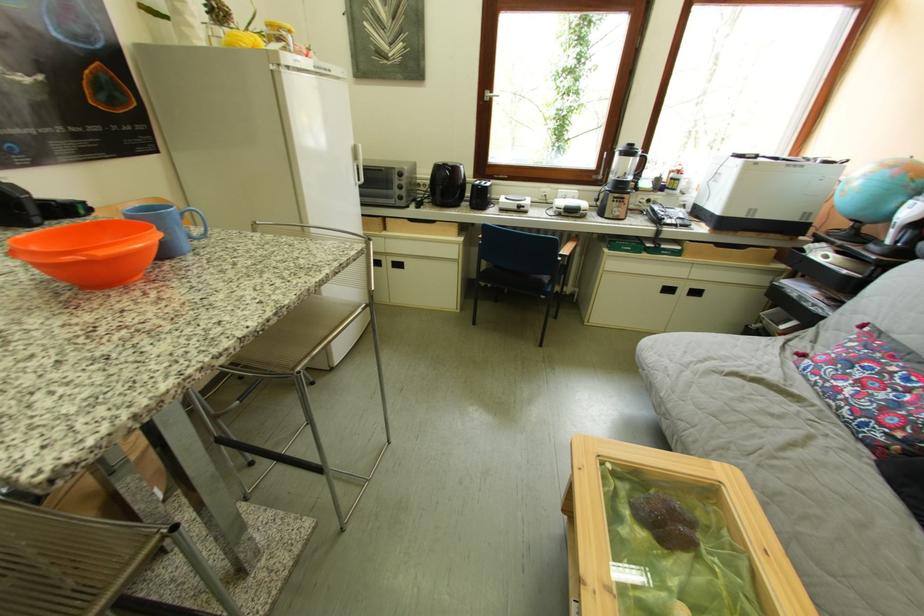
Find the location of `patterned pillow`. patterned pillow is located at coordinates (870, 389).